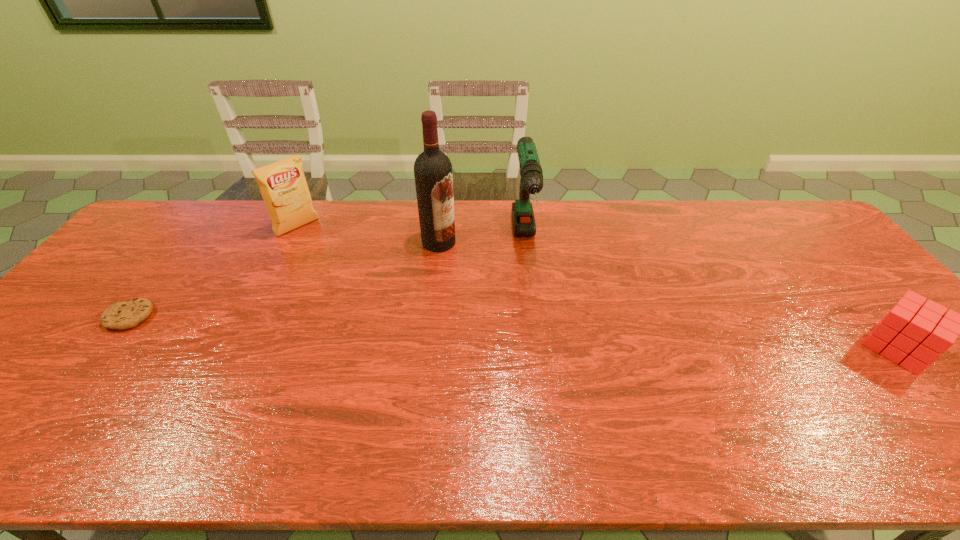
Locate an element on the screen. This screenshot has height=540, width=960. vacant area located on the front of the crisp (potato chip) with the logo is located at coordinates (330, 258).

At what (x,y) coordinates should I click in order to perform the action: click on drill that is at the far edge. Please return your answer as a coordinate pair (x, y). Looking at the image, I should click on (531, 173).

Where is `wine bottle present at the far edge`? wine bottle present at the far edge is located at coordinates click(433, 175).

Locate an element on the screen. The image size is (960, 540). crisp (potato chip) that is positioned at the far edge is located at coordinates (283, 186).

Identify the location of object present at the left edge. (122, 315).

Where is `object that is at the right edge`? object that is at the right edge is located at coordinates (917, 333).

In the image, there is a desktop. Where is `blank space at the far edge`? This screenshot has height=540, width=960. blank space at the far edge is located at coordinates (614, 235).

I want to click on vacant region at the near edge of the desktop, so click(769, 412).

In order to click on vacant space at the left edge of the desktop in this screenshot , I will do `click(106, 293)`.

In the image, there is a desktop. At what (x,y) coordinates should I click in order to perform the action: click on vacant space at the far left corner. Please return your answer as a coordinate pair (x, y). Looking at the image, I should click on (173, 222).